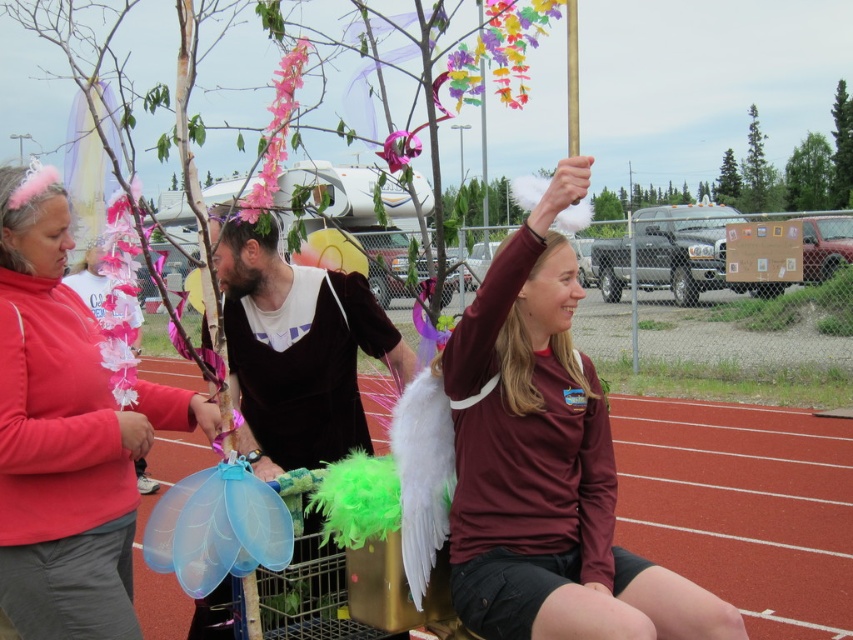
Question: Does maroon jersey at center have a lesser width compared to matte pink scarf at left?

Choices:
 (A) yes
 (B) no

Answer: (B)

Question: Does matte pink scarf at left have a larger size compared to velvet brown shirt at center?

Choices:
 (A) no
 (B) yes

Answer: (A)

Question: Which of these objects is positioned closest to the matte pink scarf at left?

Choices:
 (A) maroon jersey at center
 (B) velvet brown shirt at center

Answer: (B)

Question: Which point is closer to the camera?

Choices:
 (A) (460, 560)
 (B) (306, 358)

Answer: (A)

Question: Where is maroon jersey at center located in relation to matte pink scarf at left in the image?

Choices:
 (A) above
 (B) below

Answer: (A)

Question: Which point is closer to the camera?

Choices:
 (A) velvet brown shirt at center
 (B) maroon jersey at center

Answer: (B)